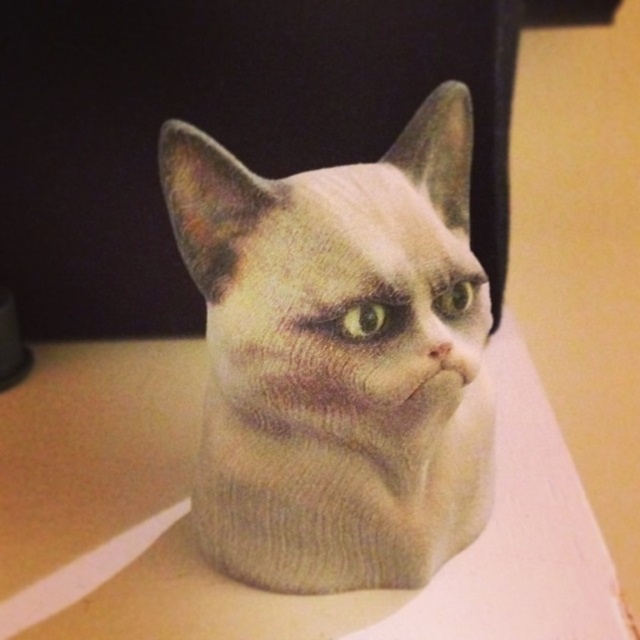
You are a photographer who wants to ensure the focus of the image is on the cat. The camera is currently focused on a point at point [422,147]. Given that the distance from the camera to this point is 3.98 feet, and the cat is positioned closer to the camera than this point, will the cat be in focus?

The distance of point [422,147] from camera is 3.98 feet. Since the cat is positioned closer to the camera than this point, the cat will not be in focus if the camera is focused on the point at 3.98 feet.

You are a photographer trying to capture a portrait of the fuzzy beige cat at center and the white matte table at center. Based on their positions, which object should you focus on first if you want to ensure both are in frame?

The fuzzy beige cat at center is to the right of white matte table at center, so you should focus on the white matte table at center first to ensure both are in frame.

You are a photographer trying to capture a close shot of the fuzzy beige cat at center. Since the white matte table at center is in the background, will the cat be in focus if you focus on the table?

The fuzzy beige cat at center is in front of the white matte table at center, so focusing on the table would leave the cat out of focus. You should focus on the cat instead.